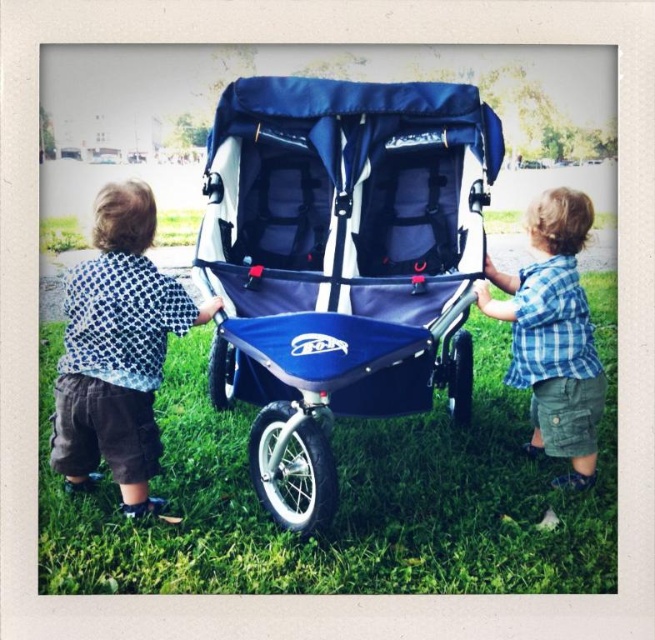
Can you confirm if blue fabric stroller at center is positioned above green grass at center?

Yes.

Is blue fabric stroller at center positioned in front of green grass at center?

Yes, it is.

The image size is (655, 640). What do you see at coordinates (341, 262) in the screenshot?
I see `blue fabric stroller at center` at bounding box center [341, 262].

The width and height of the screenshot is (655, 640). Identify the location of blue fabric stroller at center. (341, 262).

Consider the image. Who is taller, green grass at center or blue plaid shirt at center?

With more height is blue plaid shirt at center.

Is point (153, 541) closer to camera compared to point (521, 310)?

Yes, point (153, 541) is in front of point (521, 310).

What are the coordinates of `green grass at center` in the screenshot? It's located at (345, 496).

Which of these two, polka dot shirt at left or blue plaid shirt at center, stands shorter?

blue plaid shirt at center

Can you confirm if polka dot shirt at left is positioned below blue plaid shirt at center?

Correct, polka dot shirt at left is located below blue plaid shirt at center.

The width and height of the screenshot is (655, 640). In order to click on polka dot shirt at left in this screenshot , I will do coord(117,349).

Find the location of a particular element. Image resolution: width=655 pixels, height=640 pixels. polka dot shirt at left is located at coordinates (117, 349).